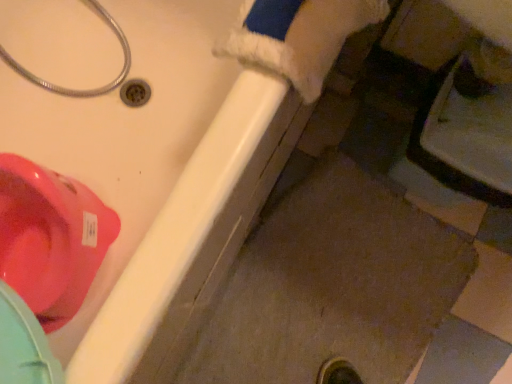
Question: Is matte white bathtub at lower left bigger than glossy plastic toilet at upper left?

Choices:
 (A) yes
 (B) no

Answer: (A)

Question: Can you confirm if matte white bathtub at lower left is thinner than glossy plastic toilet at upper left?

Choices:
 (A) yes
 (B) no

Answer: (B)

Question: Is matte white bathtub at lower left oriented away from glossy plastic toilet at upper left?

Choices:
 (A) no
 (B) yes

Answer: (B)

Question: Can you confirm if matte white bathtub at lower left is smaller than glossy plastic toilet at upper left?

Choices:
 (A) no
 (B) yes

Answer: (A)

Question: Can we say matte white bathtub at lower left lies outside glossy plastic toilet at upper left?

Choices:
 (A) yes
 (B) no

Answer: (A)

Question: Choose the correct answer: Is glossy plastic toilet at upper left inside matte white bathtub at lower left or outside it?

Choices:
 (A) inside
 (B) outside

Answer: (A)

Question: From a real-world perspective, is glossy plastic toilet at upper left positioned above or below matte white bathtub at lower left?

Choices:
 (A) above
 (B) below

Answer: (B)

Question: Is glossy plastic toilet at upper left taller or shorter than matte white bathtub at lower left?

Choices:
 (A) short
 (B) tall

Answer: (A)

Question: Considering the positions of point (96, 200) and point (170, 236), is point (96, 200) closer or farther from the camera than point (170, 236)?

Choices:
 (A) farther
 (B) closer

Answer: (A)

Question: Considering the positions of metallic silver hose at upper left and matte white bathtub at lower left in the image, is metallic silver hose at upper left taller or shorter than matte white bathtub at lower left?

Choices:
 (A) short
 (B) tall

Answer: (A)

Question: Choose the correct answer: Is metallic silver hose at upper left inside matte white bathtub at lower left or outside it?

Choices:
 (A) inside
 (B) outside

Answer: (A)

Question: Is metallic silver hose at upper left bigger or smaller than matte white bathtub at lower left?

Choices:
 (A) small
 (B) big

Answer: (A)

Question: From the image's perspective, is metallic silver hose at upper left located above or below matte white bathtub at lower left?

Choices:
 (A) above
 (B) below

Answer: (A)

Question: From a real-world perspective, is matte white bathtub at lower left physically located above or below metallic silver hose at upper left?

Choices:
 (A) above
 (B) below

Answer: (B)

Question: Based on their sizes in the image, would you say matte white bathtub at lower left is bigger or smaller than metallic silver hose at upper left?

Choices:
 (A) big
 (B) small

Answer: (A)